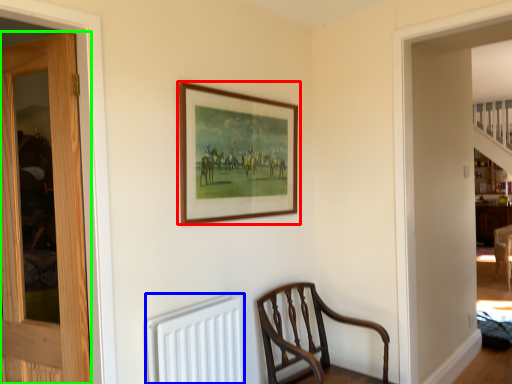
Question: Which is nearer to the picture frame (highlighted by a red box)? radiator (highlighted by a blue box) or door (highlighted by a green box).

Choices:
 (A) radiator
 (B) door

Answer: (A)